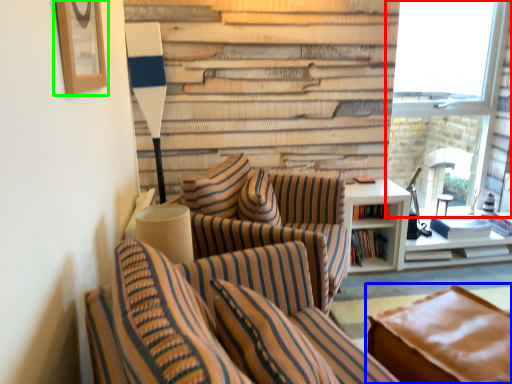
Question: Which object is the closest to the window (highlighted by a red box)? Choose among these: studio couch (highlighted by a blue box) or picture frame (highlighted by a green box).

Choices:
 (A) studio couch
 (B) picture frame

Answer: (A)